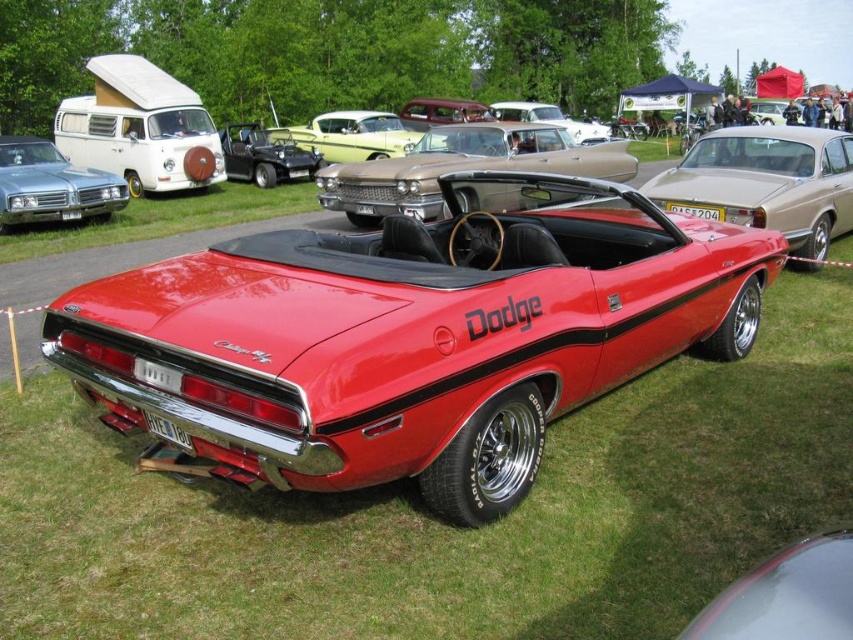
You are standing at the center of the car show and want to locate the shiny red dodge challenger at center. According to the coordinates provided, in which direction should you look to find it?

The shiny red dodge challenger at center is located at coordinates point (407, 339). Since you are at the center, which is typically considered as point (426, 320), the challenger is slightly to the left and above your position. Therefore, you should look slightly to your left and upwards to locate it.

You are standing at the point with coordinates point [264,156] in the car show image. What object are you currently standing on?

The point [264,156] is located on the metallic black convertible at center.